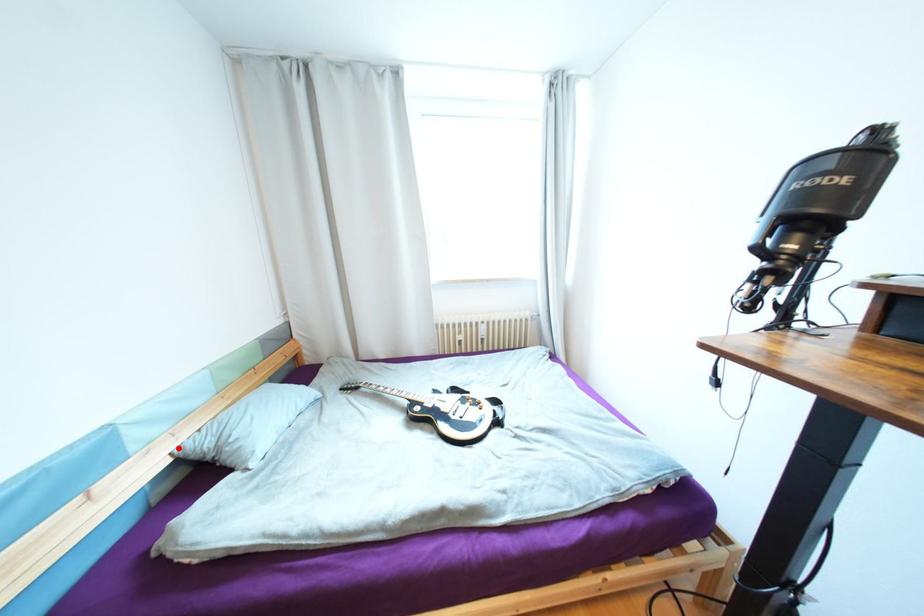
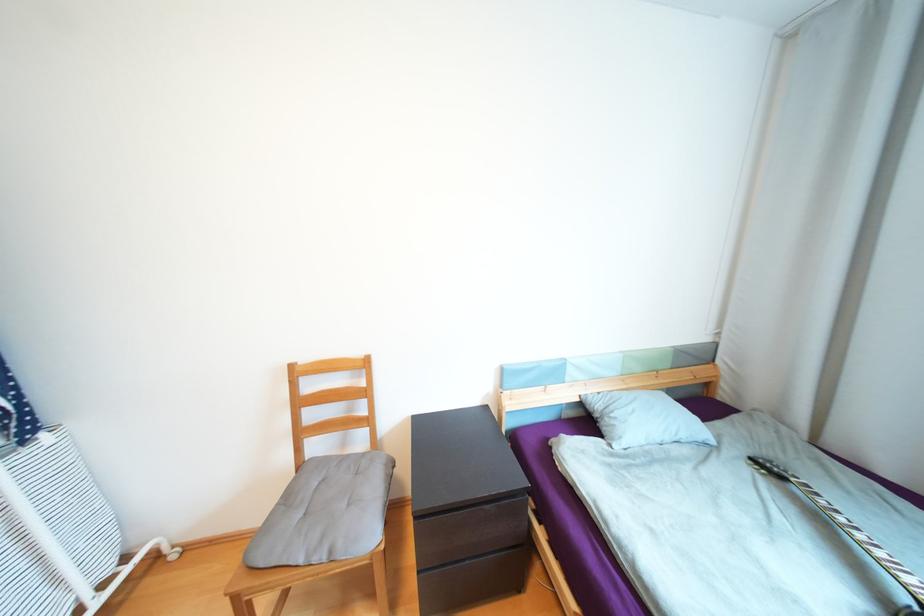
Question: I am providing you with two images of the same scene from different viewpoints. In image1, a red point is highlighted. Considering the same 3D point in image2, which of the following is correct?

Choices:
 (A) It is closer
 (B) It is farther

Answer: (B)